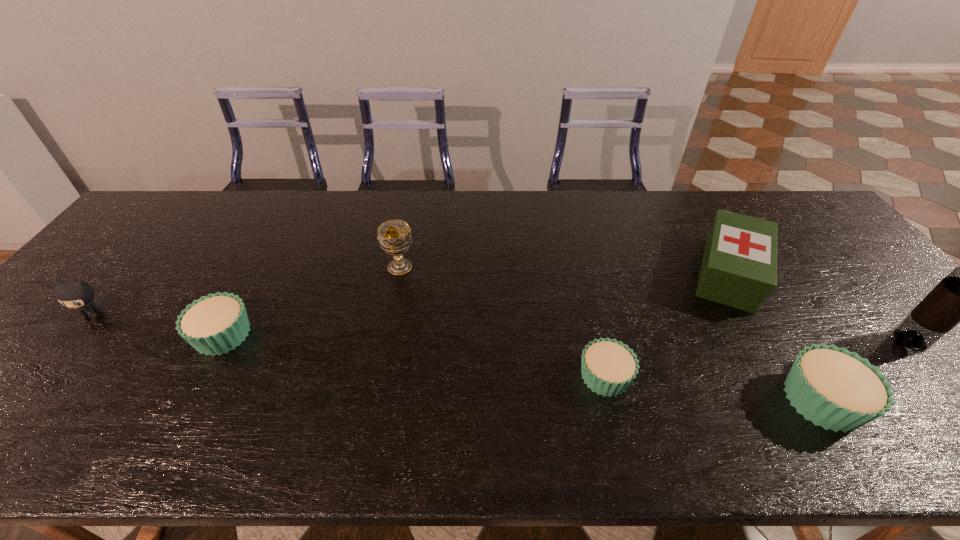
At what (x,y) coordinates should I click in order to perform the action: click on free space that satisfies the following two spatial constraints: 1. on the front-facing side of the kitten; 2. on the right side of the shortest object. Please return your answer as a coordinate pair (x, y). Image resolution: width=960 pixels, height=540 pixels. Looking at the image, I should click on (41, 376).

You are a GUI agent. You are given a task and a screenshot of the screen. Output one action in this format:
    pyautogui.click(x=<x>, y=<y>)
    Task: Click on the vacant area that satisfies the following two spatial constraints: 1. on the front-facing side of the rightmost cupcake; 2. on the right side of the leftmost object
    The height and width of the screenshot is (540, 960).
    Given the screenshot: What is the action you would take?
    pyautogui.click(x=21, y=400)